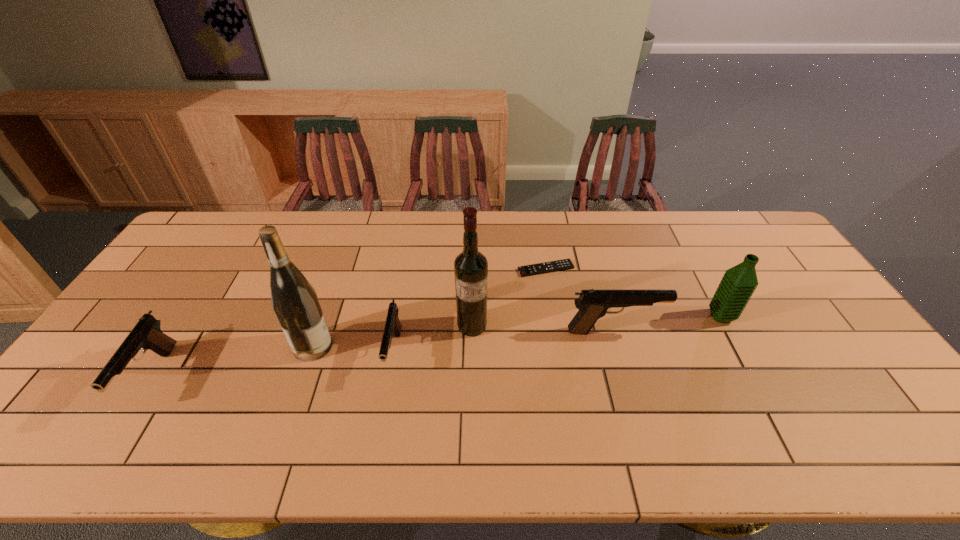
I want to click on free spot between the left wine bottle and the leftmost object, so click(x=232, y=362).

Identify the location of unoccupied position between the water bottle and the second object from left to right. This screenshot has height=540, width=960. (517, 332).

Identify the location of free point between the fifth shortest object and the rightmost pistol. The width and height of the screenshot is (960, 540). pos(667,323).

Find the location of a particular element. This screenshot has height=540, width=960. free area in between the left wine bottle and the rightmost pistol is located at coordinates (464, 339).

This screenshot has height=540, width=960. I want to click on empty location between the fourth object from right to left and the shortest object, so click(509, 298).

Identify which object is the fourth nearest to the remote control. Please provide its 2D coordinates. Your answer should be formatted as a tuple, i.e. [(x, y)], where the tuple contains the x and y coordinates of a point satisfying the conditions above.

[(393, 326)]

Identify which object is the third closest to the right wine bottle. Please provide its 2D coordinates. Your answer should be formatted as a tuple, i.e. [(x, y)], where the tuple contains the x and y coordinates of a point satisfying the conditions above.

[(593, 304)]

Choose which pistol is the third nearest neighbor to the second object from left to right. Please provide its 2D coordinates. Your answer should be formatted as a tuple, i.e. [(x, y)], where the tuple contains the x and y coordinates of a point satisfying the conditions above.

[(593, 304)]

The image size is (960, 540). In order to click on pistol that can be found as the third closest to the right wine bottle in this screenshot , I will do `click(146, 334)`.

Where is `vacant region that satisfies the following two spatial constraints: 1. on the back side of the left wine bottle; 2. on the left side of the water bottle`? This screenshot has height=540, width=960. vacant region that satisfies the following two spatial constraints: 1. on the back side of the left wine bottle; 2. on the left side of the water bottle is located at coordinates (324, 316).